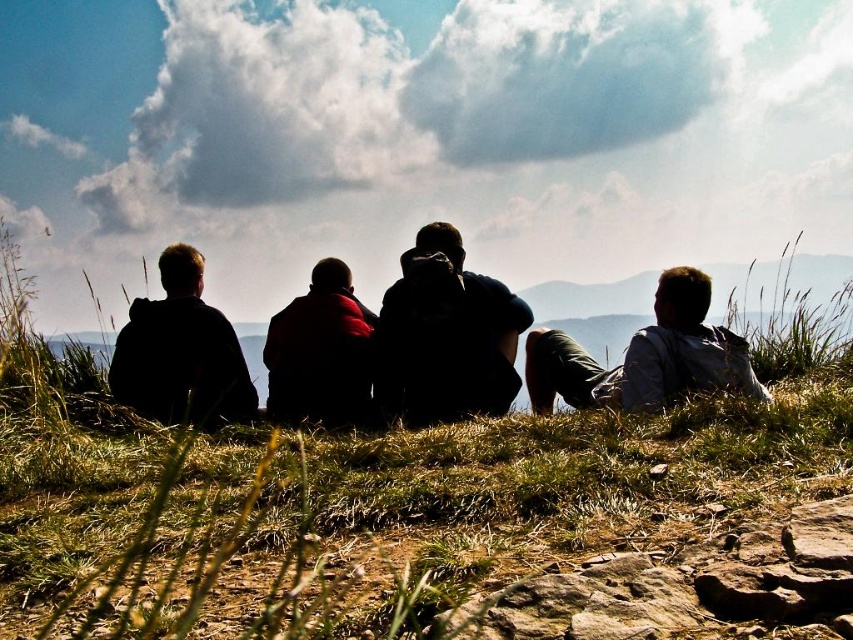
Is green grassy at center positioned behind red woolen sweater at center?

No, it is in front of red woolen sweater at center.

Which is behind, point (357, 508) or point (321, 268)?

The point (321, 268) is more distant.

Between point (175, 560) and point (328, 371), which one is positioned in front?

Point (175, 560) is more forward.

You are a GUI agent. You are given a task and a screenshot of the screen. Output one action in this format:
    pyautogui.click(x=<x>, y=<y>)
    Task: Click on the green grassy at center
    The image size is (853, 640).
    Given the screenshot: What is the action you would take?
    pyautogui.click(x=415, y=518)

Does silhouette jacket at center have a lesser height compared to black matte jacket at left?

Incorrect, silhouette jacket at center's height does not fall short of black matte jacket at left's.

Which is behind, point (444, 372) or point (141, 339)?

Positioned behind is point (141, 339).

Does point (431, 323) come closer to viewer compared to point (193, 278)?

That is True.

Identify the location of silhouette jacket at center. (445, 337).

Consider the image. Is light gray fabric shirt at center above red woolen sweater at center?

Actually, light gray fabric shirt at center is below red woolen sweater at center.

Describe the element at coordinates (645, 356) in the screenshot. Image resolution: width=853 pixels, height=640 pixels. I see `light gray fabric shirt at center` at that location.

Find the location of a particular element. Image resolution: width=853 pixels, height=640 pixels. light gray fabric shirt at center is located at coordinates (645, 356).